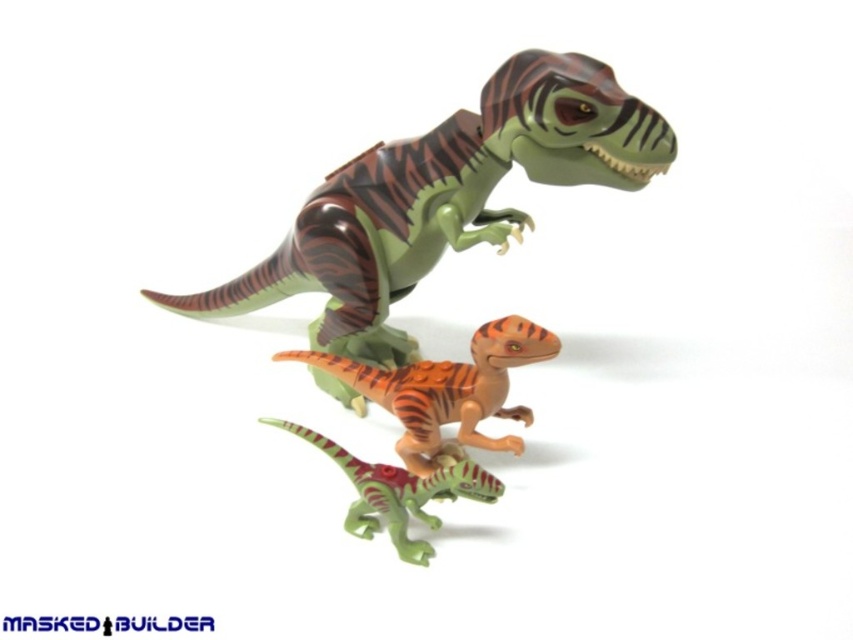
You are a photographer standing 1.5 meters away from the green matte tyrannosaurus rex at center. You want to take a closeup photo of it. Do you need to move closer or farther away?

The green matte tyrannosaurus rex at center is currently 1.10 meters away from the camera. Since you are standing 1.5 meters away, you need to move closer to get a closeup photo.